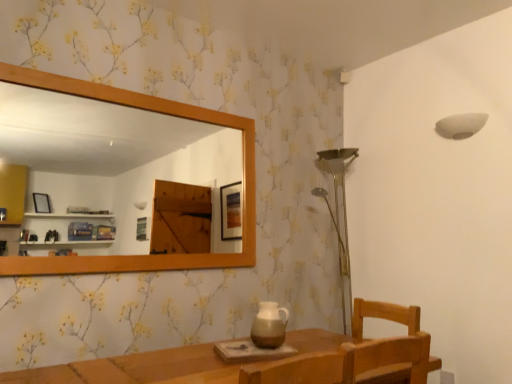
Locate an element on the screen. The width and height of the screenshot is (512, 384). brown ceramic pitcher at center is located at coordinates (269, 325).

Locate an element on the screen. The width and height of the screenshot is (512, 384). white matte lampshade at upper right is located at coordinates click(461, 125).

Are wooden mirror at upper left and white matte lampshade at upper right making contact?

They are not placed beside each other.

In terms of height, does wooden mirror at upper left look taller or shorter compared to white matte lampshade at upper right?

Clearly, wooden mirror at upper left is taller compared to white matte lampshade at upper right.

Is wooden mirror at upper left oriented away from white matte lampshade at upper right?

That's not correct — wooden mirror at upper left is not looking away from white matte lampshade at upper right.

Considering the sizes of objects wooden mirror at upper left and white matte lampshade at upper right in the image provided, who is wider, wooden mirror at upper left or white matte lampshade at upper right?

Wider between the two is white matte lampshade at upper right.

Considering the relative sizes of brown ceramic pitcher at center and white matte lampshade at upper right in the image provided, is brown ceramic pitcher at center thinner than white matte lampshade at upper right?

No.

From a real-world perspective, is brown ceramic pitcher at center beneath white matte lampshade at upper right?

Yes, from a real-world perspective, brown ceramic pitcher at center is under white matte lampshade at upper right.

Which of these two, brown ceramic pitcher at center or white matte lampshade at upper right, is bigger?

With larger size is white matte lampshade at upper right.

Find the location of a particular element. tea pot below the white matte lampshade at upper right (from a real-world perspective) is located at coordinates (269, 325).

Who is shorter, wooden mirror at upper left or brown ceramic pitcher at center?

brown ceramic pitcher at center.

From a real-world perspective, which object rests below the other?

brown ceramic pitcher at center is physically lower.

Is wooden mirror at upper left surrounding brown ceramic pitcher at center?

No, brown ceramic pitcher at center is not a part of wooden mirror at upper left.

Is white matte lampshade at upper right taller than wooden mirror at upper left?

No, white matte lampshade at upper right is not taller than wooden mirror at upper left.

Which is behind, point (480, 123) or point (94, 163)?

The point (94, 163) is farther.

Consider the image. Considering the positions of objects white matte lampshade at upper right and wooden mirror at upper left in the image provided, who is in front, white matte lampshade at upper right or wooden mirror at upper left?

Positioned in front is wooden mirror at upper left.

Considering the positions of objects white matte lampshade at upper right and wooden mirror at upper left in the image provided, who is more to the right, white matte lampshade at upper right or wooden mirror at upper left?

white matte lampshade at upper right.

Is white matte lampshade at upper right behind brown ceramic pitcher at center?

Yes.

From a real-world perspective, who is located higher, white matte lampshade at upper right or brown ceramic pitcher at center?

white matte lampshade at upper right is physically above.

Considering the sizes of white matte lampshade at upper right and brown ceramic pitcher at center in the image, is white matte lampshade at upper right taller or shorter than brown ceramic pitcher at center?

Clearly, white matte lampshade at upper right is shorter compared to brown ceramic pitcher at center.

Is white matte lampshade at upper right wider or thinner than brown ceramic pitcher at center?

Clearly, white matte lampshade at upper right has less width compared to brown ceramic pitcher at center.

Is brown ceramic pitcher at center oriented away from wooden mirror at upper left?

No, brown ceramic pitcher at center is not facing the opposite direction of wooden mirror at upper left.

In the scene shown: Considering the positions of objects brown ceramic pitcher at center and wooden mirror at upper left in the image provided, who is more to the right, brown ceramic pitcher at center or wooden mirror at upper left?

Positioned to the right is brown ceramic pitcher at center.

Find the location of a particular element. Image resolution: width=512 pixels, height=384 pixels. tea pot to the right of wooden mirror at upper left is located at coordinates (269, 325).

Does point (286, 325) come in front of point (169, 155)?

Yes.

The image size is (512, 384). In order to click on mirror below the white matte lampshade at upper right (from the image's perspective) in this screenshot , I will do `click(110, 163)`.

Locate an element on the screen. lamp on the right of brown ceramic pitcher at center is located at coordinates (461, 125).

Based on their spatial positions, is white matte lampshade at upper right or brown ceramic pitcher at center further from wooden mirror at upper left?

brown ceramic pitcher at center.

When comparing their distances from white matte lampshade at upper right, does brown ceramic pitcher at center or wooden mirror at upper left seem further?

Among the two, wooden mirror at upper left is located further to white matte lampshade at upper right.

When comparing their distances from wooden mirror at upper left, does brown ceramic pitcher at center or white matte lampshade at upper right seem further?

brown ceramic pitcher at center.

When comparing their distances from white matte lampshade at upper right, does wooden mirror at upper left or brown ceramic pitcher at center seem further?

The object further to white matte lampshade at upper right is wooden mirror at upper left.

Looking at the image, which one is located further to brown ceramic pitcher at center, wooden mirror at upper left or white matte lampshade at upper right?

wooden mirror at upper left is positioned further to the anchor brown ceramic pitcher at center.

Looking at the image, which one is located closer to brown ceramic pitcher at center, white matte lampshade at upper right or wooden mirror at upper left?

Among the two, white matte lampshade at upper right is located nearer to brown ceramic pitcher at center.

Find the location of a particular element. The width and height of the screenshot is (512, 384). tea pot situated between wooden mirror at upper left and white matte lampshade at upper right from left to right is located at coordinates (269, 325).